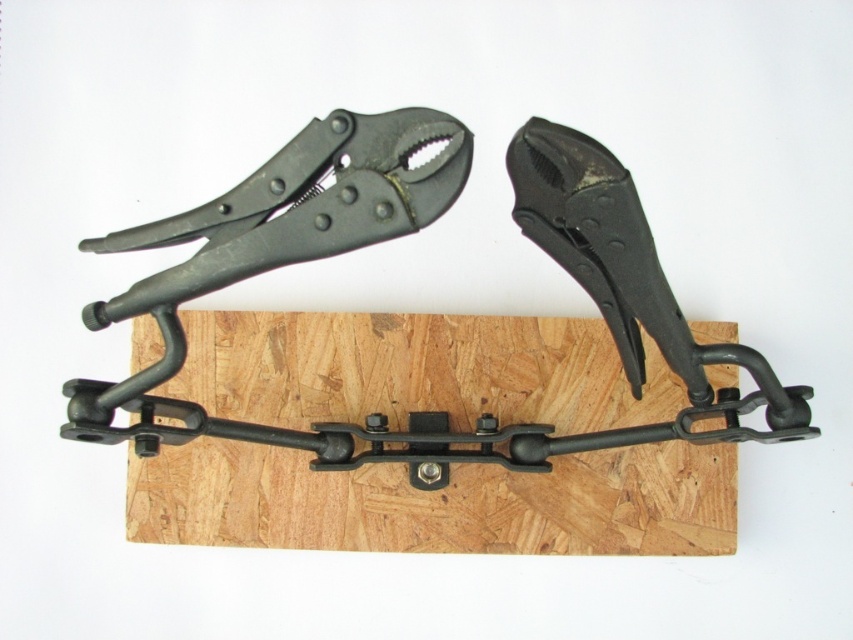
You are a delivery person who needs to place a new tool on the wooden surface. The new tool requires at least 15 centimeters of space between it and any existing objects. You have a tool that is 14 centimeters long. Can you safely place it between the black metal plank at center and the matte black pliers at upper center?

The black metal plank at center and the matte black pliers at upper center are 16.34 centimeters apart. Since the required space is at least 15 centimeters and the available space is 16.34 centimeters, placing the 14 centimeter tool between them would leave 2.34 centimeters of space on each side. This meets the requirement as the total distance between the objects is sufficient. However, the question specifies that the new tool needs at least 15 centimeters between it and any existing objects. Since the new

You are a tool organizer trying to arrange items on a shelf. You have the black metal plank at center and the matte black pliers at upper center. If you want to place them side by side, which one should you move forward so that both are visible?

The matte black pliers at upper center is behind the black metal plank at center, so you should move the matte black pliers at upper center forward to ensure both are visible.

You are a mechanic working on a project and need to secure a metal plank. You have the black metal plank at center and the matte black pliers at upper center in your workspace. Which object should you use to hold the metal plank in place?

The matte black pliers at upper center should be used to hold the metal plank at center in place since the pliers are positioned above the plank, making them accessible for gripping.